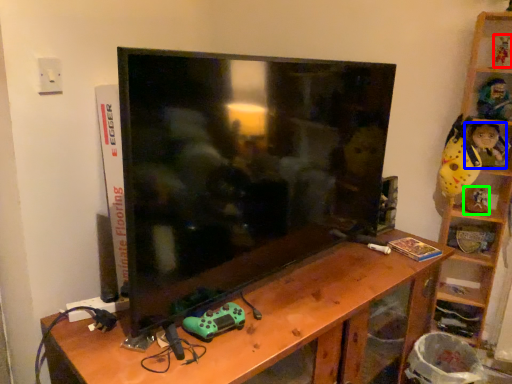
Question: Which object is the farthest from toy (highlighted by a red box)? Choose among these: toy (highlighted by a blue box) or toy (highlighted by a green box).

Choices:
 (A) toy
 (B) toy

Answer: (B)